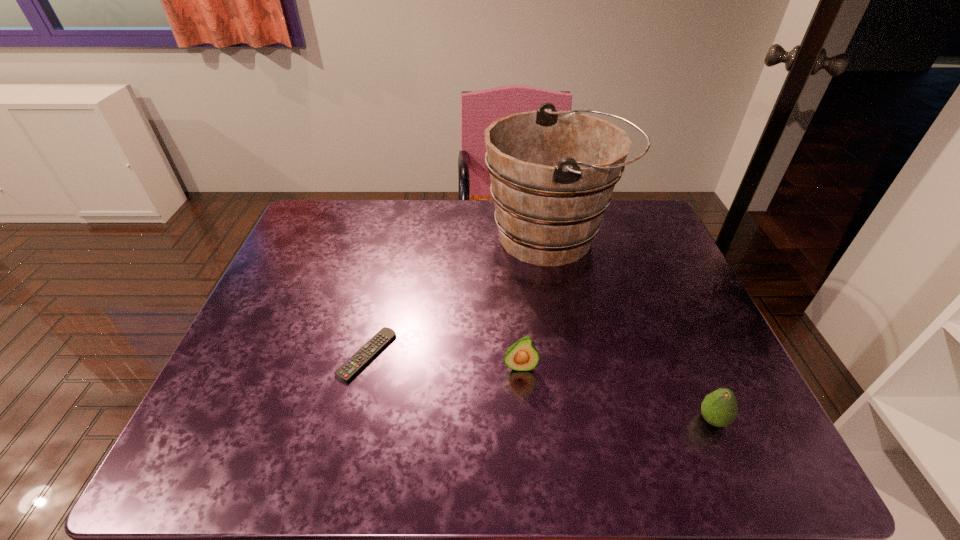
Find the location of a particular element. This screenshot has width=960, height=540. vacant space located on the right of the remote control is located at coordinates (555, 355).

This screenshot has width=960, height=540. What are the coordinates of `object located in the far edge section of the desktop` in the screenshot? It's located at (553, 172).

In order to click on object located in the near edge section of the desktop in this screenshot , I will do click(x=719, y=408).

Where is `bucket located at the right edge`? Image resolution: width=960 pixels, height=540 pixels. bucket located at the right edge is located at coordinates (553, 172).

Find the location of `avocado located in the right edge section of the desktop`. avocado located in the right edge section of the desktop is located at coordinates (719, 408).

Where is `object located at the far right corner`? The height and width of the screenshot is (540, 960). object located at the far right corner is located at coordinates (553, 172).

You are a GUI agent. You are given a task and a screenshot of the screen. Output one action in this format:
    pyautogui.click(x=<x>, y=<y>)
    Task: Click on the object situated at the near right corner
    This screenshot has height=540, width=960.
    Given the screenshot: What is the action you would take?
    pyautogui.click(x=719, y=408)

I want to click on free space at the far edge of the desktop, so click(377, 231).

This screenshot has width=960, height=540. Identify the location of vacant space at the near edge. (646, 445).

Locate an element on the screen. blank area at the left edge is located at coordinates (317, 307).